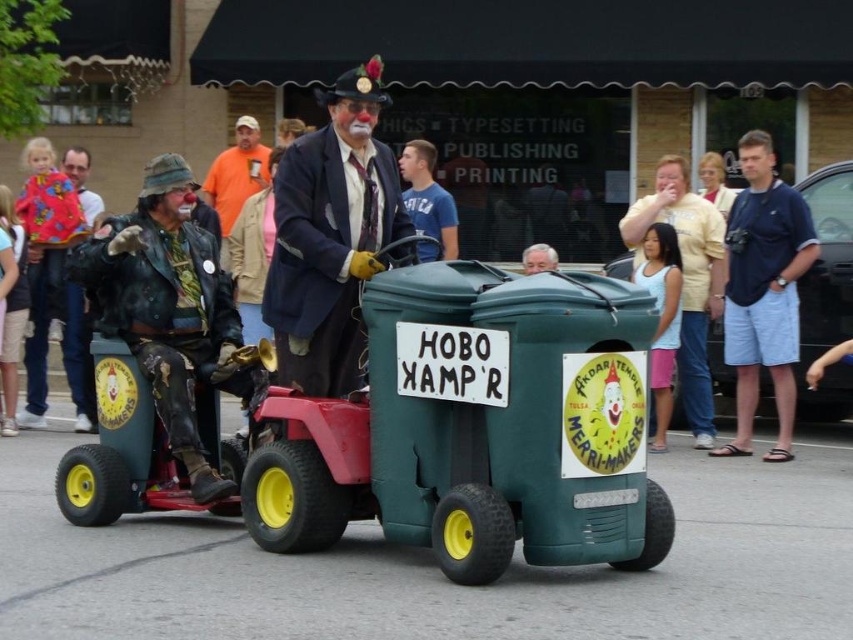
You are a photographer standing in the crowd watching the parade. You want to take a photo of both the light yellow shirt at center and the orange fabric shirt at upper center. Which shirt should you focus on first to ensure both are in focus?

You should focus on the light yellow shirt at center first because it is closer to the viewer than the orange fabric shirt at upper center. By focusing on the closer object, both will be in focus if they are within the depth of field range.

Based on the scene description, what object is located at the coordinate point (764, 291)?

The blue denim shorts at right is located at the coordinate point (764, 291).